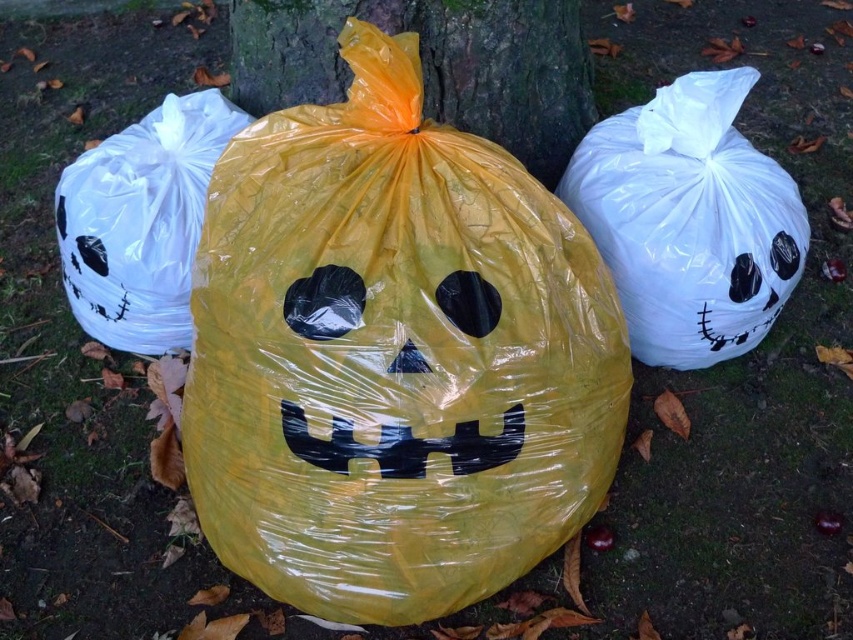
Does white glossy trash bag at right have a greater width compared to smooth bark tree trunk at center?

Incorrect, white glossy trash bag at right's width does not surpass smooth bark tree trunk at center's.

Between point (671, 156) and point (305, 42), which one is positioned behind?

Point (305, 42)

I want to click on white glossy trash bag at right, so click(x=689, y=220).

Between yellow plastic bag at center and smooth bark tree trunk at center, which one appears on the right side from the viewer's perspective?

Positioned to the right is smooth bark tree trunk at center.

Between point (398, 353) and point (281, 6), which one is positioned in front?

Point (398, 353) is more forward.

Which is behind, point (329, 160) or point (440, 74)?

The point (440, 74) is behind.

Locate an element on the screen. Image resolution: width=853 pixels, height=640 pixels. yellow plastic bag at center is located at coordinates (393, 356).

Between point (738, 346) and point (247, 120), which one is positioned behind?

The point (247, 120) is more distant.

Can you confirm if white glossy trash bag at right is taller than white plastic bag at left?

Yes.

Who is more distant from viewer, (715, 358) or (202, 186)?

The point (715, 358) is more distant.

The height and width of the screenshot is (640, 853). Identify the location of white glossy trash bag at right. (689, 220).